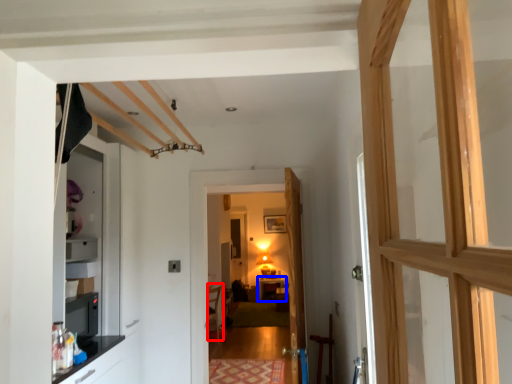
Question: Among these objects, which one is farthest to the camera, furniture (highlighted by a red box) or table (highlighted by a blue box)?

Choices:
 (A) furniture
 (B) table

Answer: (B)